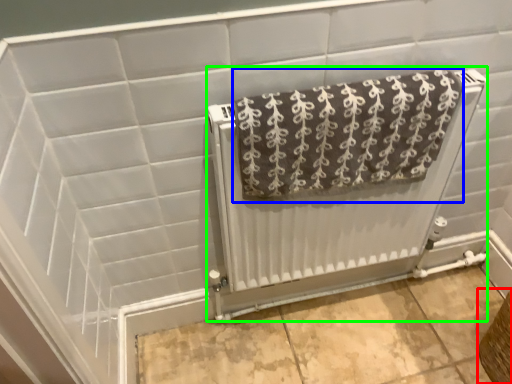
Question: Estimate the real-world distances between objects in this image. Which object is closer to basket (highlighted by a red box), towel (highlighted by a blue box) or radiator (highlighted by a green box)?

Choices:
 (A) towel
 (B) radiator

Answer: (B)